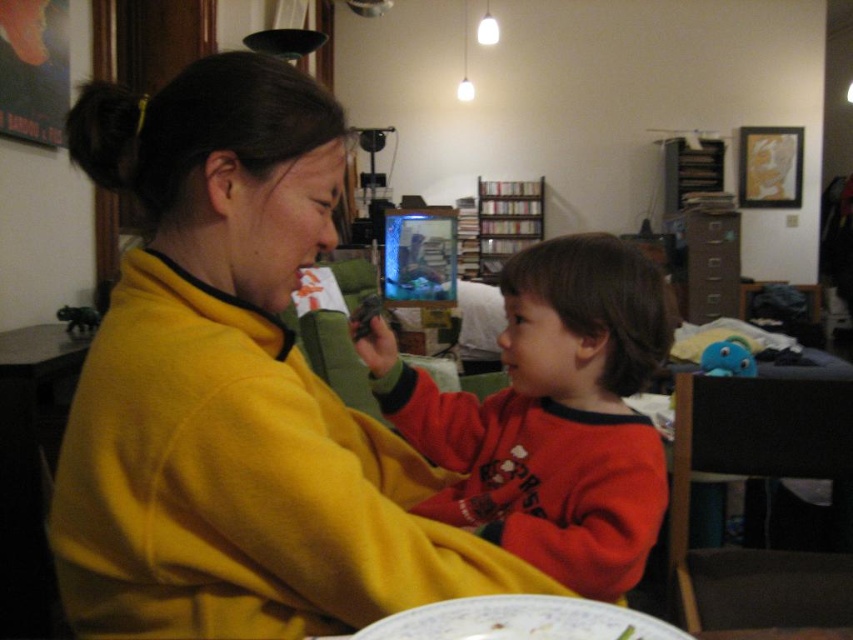
You are a photographer trying to capture a candid shot of the scene. You want to ensure that both the red fleece sweater at center and the porcelain plate at lower center are clearly visible in the frame. Based on their positions, which object should you focus on first to ensure both are in focus?

The red fleece sweater at center is positioned on the right side of the porcelain plate at lower center. To ensure both are in focus, you should focus on the porcelain plate at lower center first, as it is closer to the camera, and the sweater is slightly further to the right but still within the same plane.

You are a photographer standing in the scene. You want to take a photo of both the point at (x=50, y=506) and the point at (x=457, y=611). Which point should you focus on first to ensure both are in focus?

You should focus on the point at (x=50, y=506) first because it is closer to the camera than the point at (x=457, y=611). This ensures that both points will be in focus as the closer point sets the focal plane.

You are a parent trying to give your child a snack. You see the porcelain plate at lower center and the red fleece sweater at center. Which object is closer to you?

The red fleece sweater at center is closer to you because the porcelain plate at lower center is behind it.